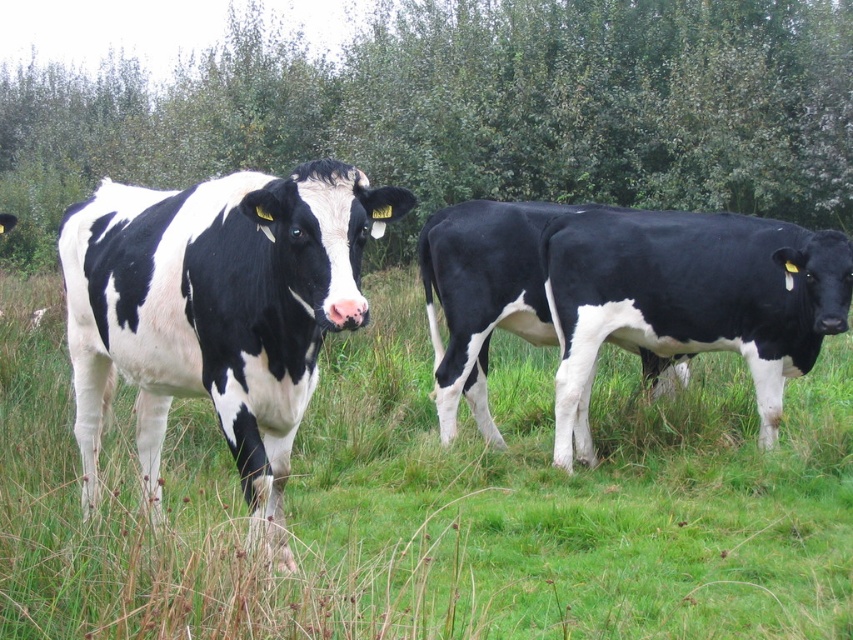
The height and width of the screenshot is (640, 853). What do you see at coordinates (436, 500) in the screenshot?
I see `black and white cow at center` at bounding box center [436, 500].

Who is taller, black and white cow at center or black smooth cow at center?

Standing taller between the two is black smooth cow at center.

Between point (436, 509) and point (560, 209), which one is positioned behind?

The point (560, 209) is behind.

The width and height of the screenshot is (853, 640). Find the location of `black and white cow at center`. black and white cow at center is located at coordinates (436, 500).

Is black and white cow at left above black smooth cow at center?

No, black and white cow at left is not above black smooth cow at center.

Between black and white cow at left and black smooth cow at center, which one has more height?

With more height is black smooth cow at center.

Who is more forward, [126,218] or [711,230]?

Point [126,218] is more forward.

Locate an element on the screen. This screenshot has width=853, height=640. black and white cow at left is located at coordinates (216, 310).

Based on the photo, is green leafy tree at upper center taller than black smooth cow at center?

Indeed, green leafy tree at upper center has a greater height compared to black smooth cow at center.

Which is in front, point (782, 45) or point (434, 358)?

Point (434, 358) is more forward.

Who is more distant from viewer, (x=502, y=13) or (x=741, y=289)?

The point (x=502, y=13) is behind.

What are the coordinates of `green leafy tree at upper center` in the screenshot? It's located at (469, 109).